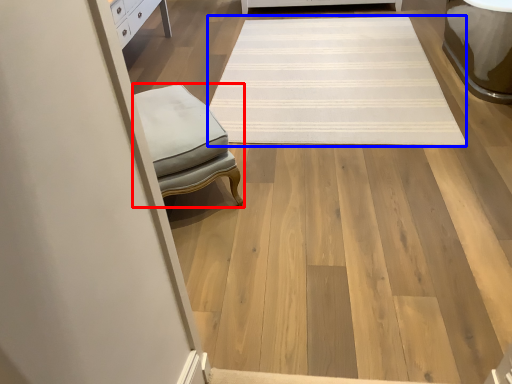
Question: Which object is closer to the camera taking this photo, furniture (highlighted by a red box) or mat (highlighted by a blue box)?

Choices:
 (A) furniture
 (B) mat

Answer: (A)